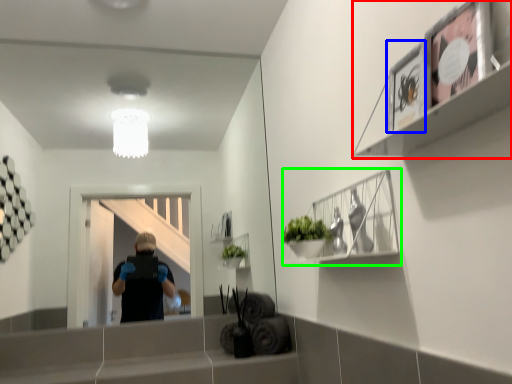
Question: Considering the real-world distances, which object is farthest from shelf (highlighted by a red box)? picture frame (highlighted by a blue box) or cabinet (highlighted by a green box)?

Choices:
 (A) picture frame
 (B) cabinet

Answer: (B)